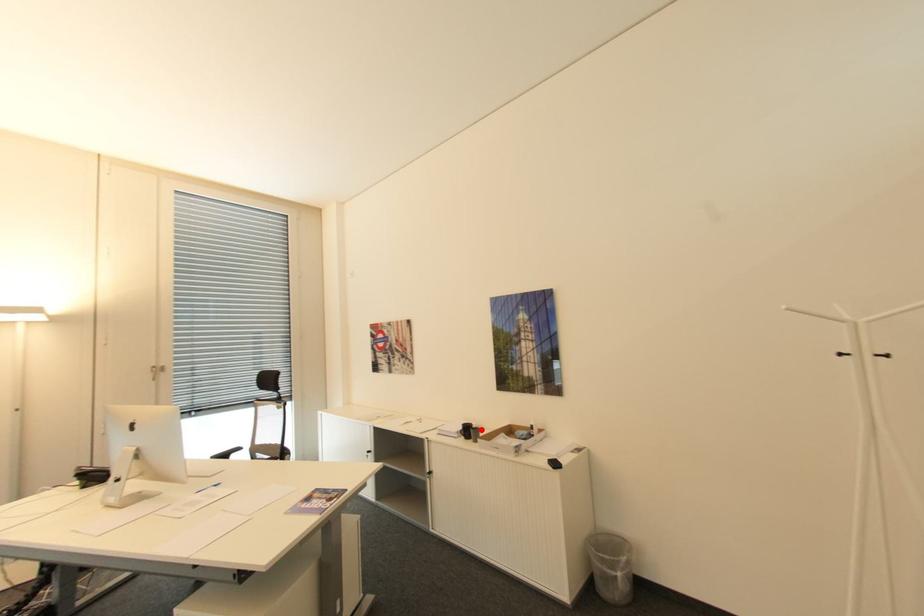
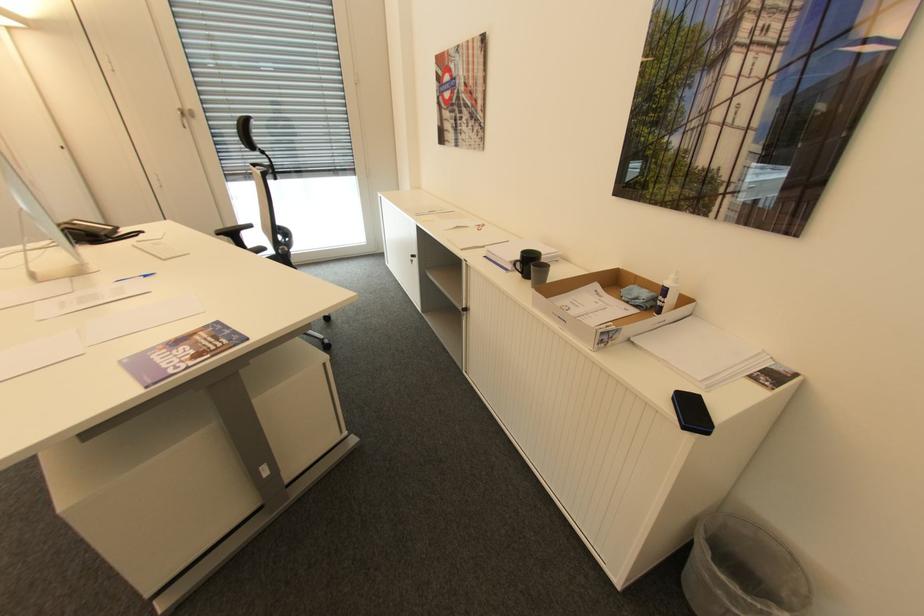
The point at the highlighted location is marked in the first image. Where is the corresponding point in the second image?

(550, 268)